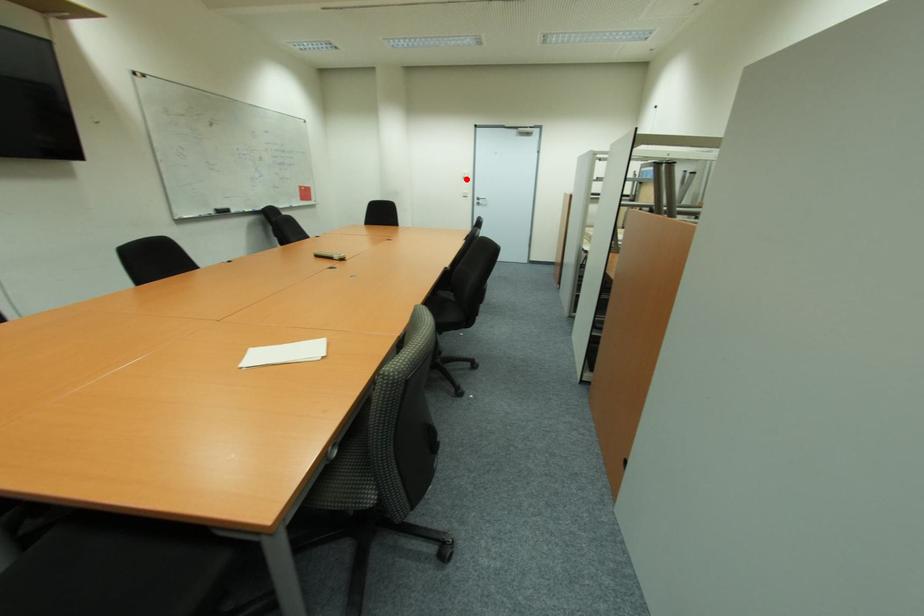
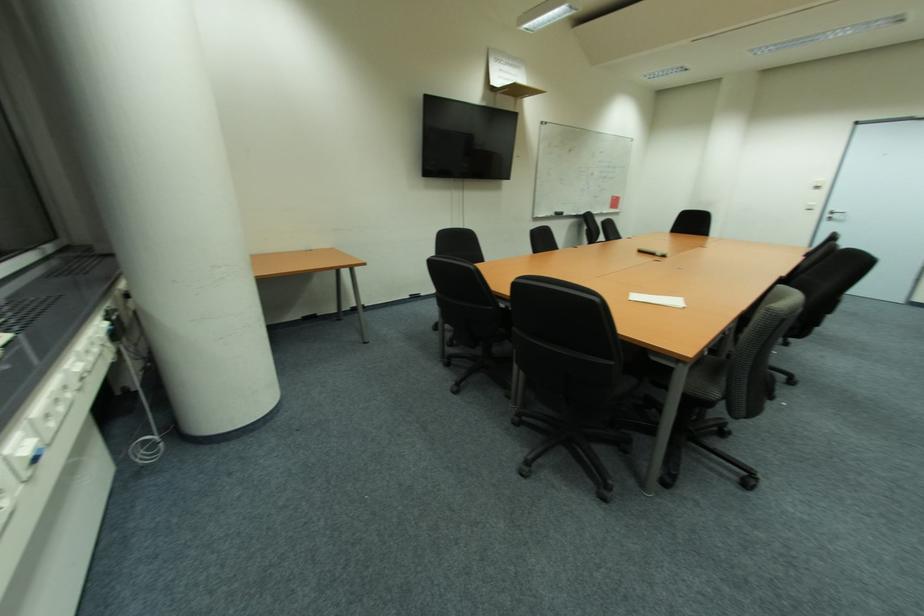
Question: A red point is marked in image1. In image2, is the corresponding 3D point closer to the camera or farther? Reply with the corresponding letter.

Choices:
 (A) The corresponding 3D point is closer.
 (B) The corresponding 3D point is farther.

Answer: (B)